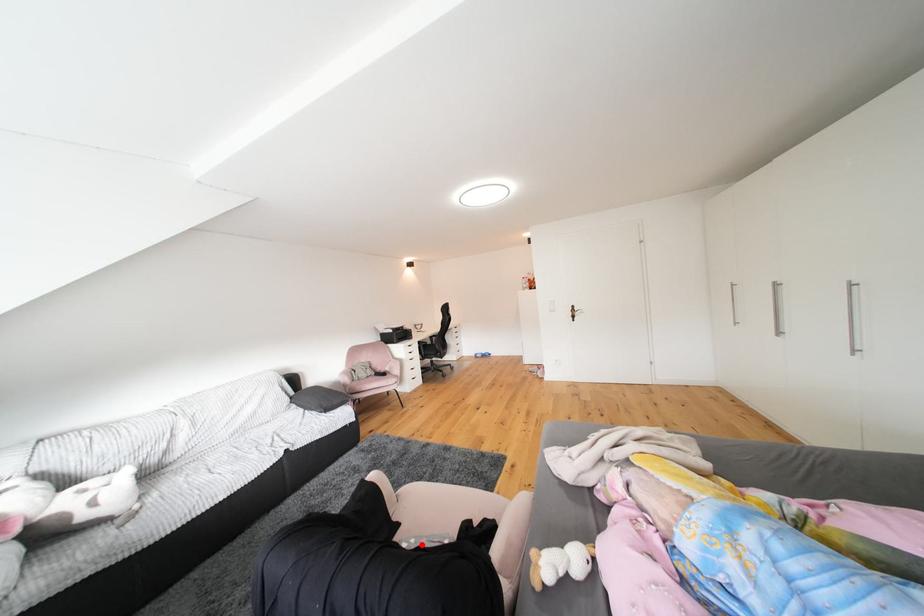
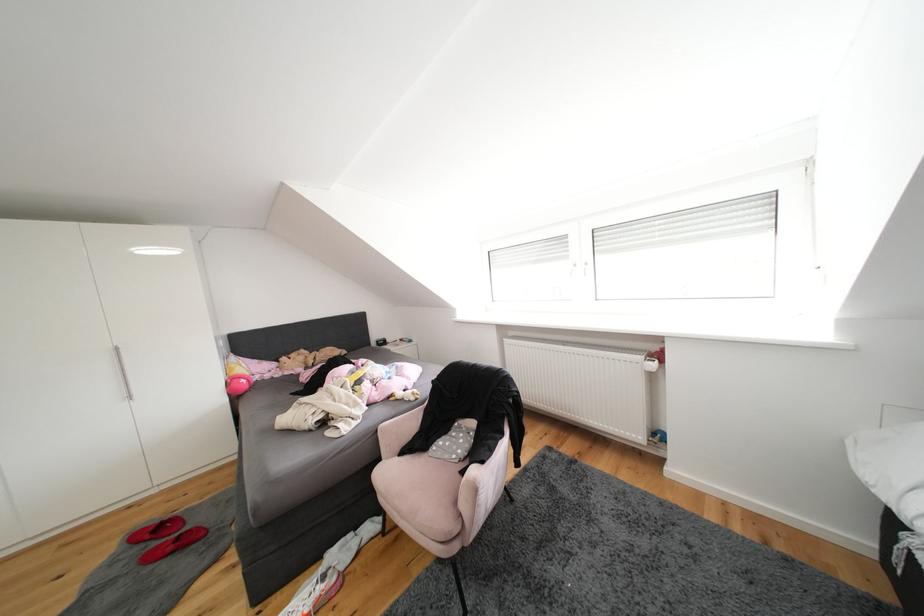
In the second image, find the point that corresponds to the highlighted location in the first image.

(464, 460)